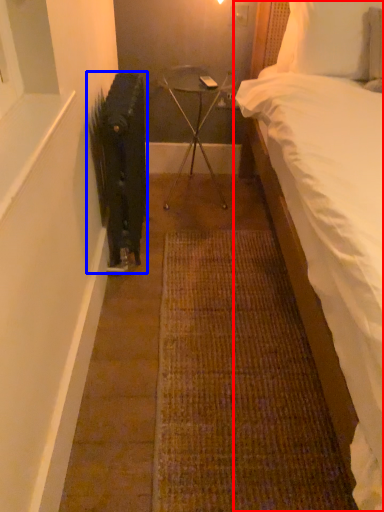
Question: Which of the following is the closest to the observer, bed (highlighted by a red box) or radiator (highlighted by a blue box)?

Choices:
 (A) bed
 (B) radiator

Answer: (A)